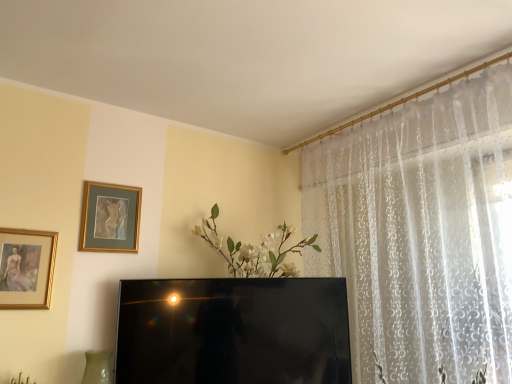
Question: From the image's perspective, is gold-framed painting at upper left, which ranks as the second picture frame in left-to-right order, located above or below black glossy television at center?

Choices:
 (A) above
 (B) below

Answer: (A)

Question: From a real-world perspective, is gold-framed painting at upper left, the 2th picture frame from the front, positioned above or below black glossy television at center?

Choices:
 (A) above
 (B) below

Answer: (A)

Question: Which is farther from the black glossy television at center?

Choices:
 (A) gold-framed painting at upper left, which is counted as the first picture frame, starting from the right
 (B) gold-framed painting at left, marked as the 2th picture frame in a back-to-front arrangement

Answer: (B)

Question: Estimate the real-world distances between objects in this image. Which object is closer to the gold-framed painting at left, marked as the 2th picture frame in a back-to-front arrangement?

Choices:
 (A) black glossy television at center
 (B) gold-framed painting at upper left, marked as the 1th picture frame in a back-to-front arrangement

Answer: (B)